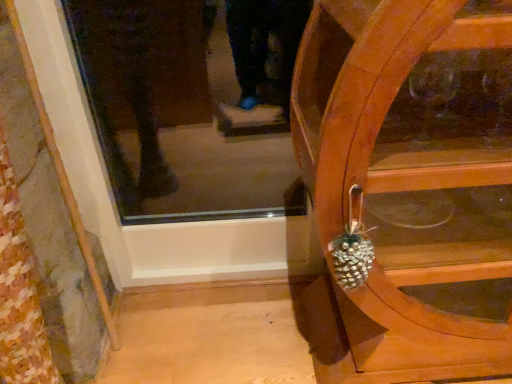
Question: Is wooden cabinet at right wider or thinner than shiny metallic pinecone at right?

Choices:
 (A) wide
 (B) thin

Answer: (A)

Question: Is wooden cabinet at right to the left or to the right of shiny metallic pinecone at right in the image?

Choices:
 (A) left
 (B) right

Answer: (B)

Question: From the image's perspective, relative to shiny metallic pinecone at right, is wooden cabinet at right above or below?

Choices:
 (A) below
 (B) above

Answer: (B)

Question: From the image's perspective, is shiny metallic pinecone at right positioned above or below wooden cabinet at right?

Choices:
 (A) below
 (B) above

Answer: (A)

Question: From their relative heights in the image, would you say shiny metallic pinecone at right is taller or shorter than wooden cabinet at right?

Choices:
 (A) tall
 (B) short

Answer: (B)

Question: In the image, is shiny metallic pinecone at right positioned in front of or behind wooden cabinet at right?

Choices:
 (A) front
 (B) behind

Answer: (B)

Question: From a real-world perspective, relative to wooden cabinet at right, is shiny metallic pinecone at right vertically above or below?

Choices:
 (A) below
 (B) above

Answer: (B)